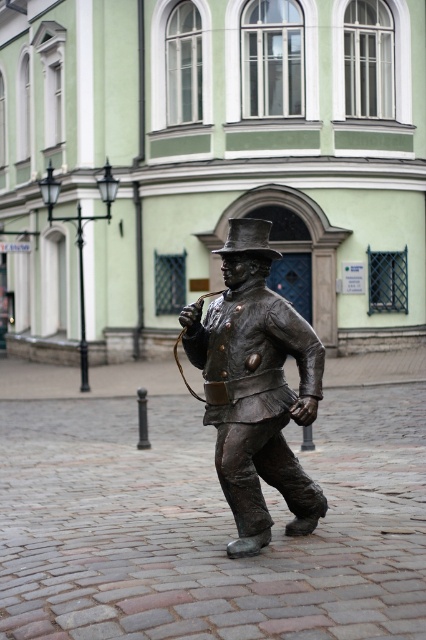
You are an art student observing the bronze statue at center and the shiny bronze hat at center. Which object is positioned higher in the image?

The shiny bronze hat at center is positioned higher than the bronze statue at center.

You are an art student analyzing the bronze statue at center and the shiny bronze hat at center. Based on their sizes, which object would cast a larger shadow on the cobblestone street?

The shiny bronze hat at center is larger in size compared to the bronze statue at center, so it would cast a larger shadow on the cobblestone street.

You are an art student analyzing the bronze statue at center and the shiny bronze hat at center. Based on their shapes, which object has a greater width?

The bronze statue at center is thinner than the shiny bronze hat at center, so the shiny bronze hat at center is wider.